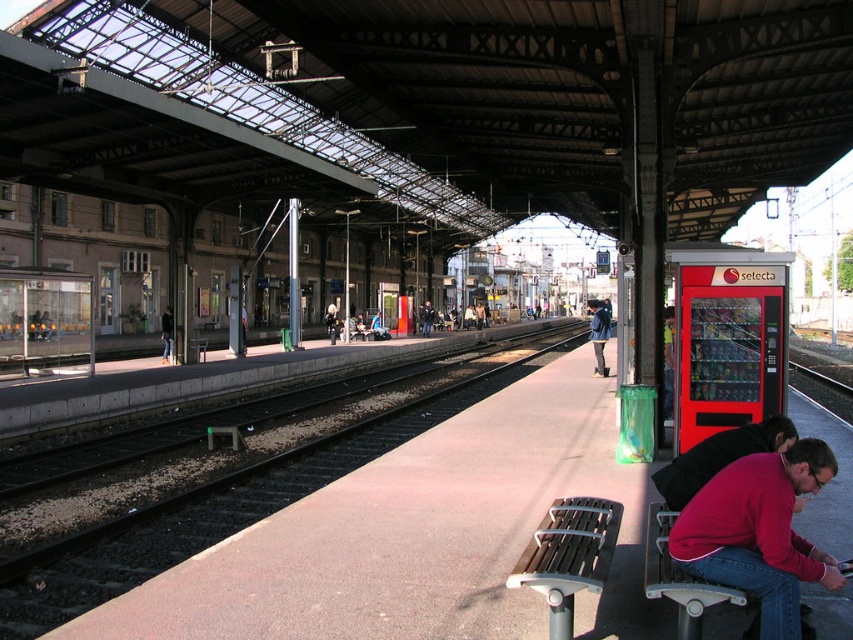
Does red sweater at lower right have a greater height compared to metallic gray bench at lower center?

Indeed, red sweater at lower right has a greater height compared to metallic gray bench at lower center.

Is red sweater at lower right wider than metallic gray bench at lower center?

No.

This screenshot has height=640, width=853. Identify the location of red sweater at lower right. (758, 532).

Does metallic silver bench at lower right have a lesser height compared to dark blue jeans at left?

Yes, metallic silver bench at lower right is shorter than dark blue jeans at left.

The height and width of the screenshot is (640, 853). What do you see at coordinates (677, 577) in the screenshot?
I see `metallic silver bench at lower right` at bounding box center [677, 577].

Where is `metallic silver bench at lower right`? This screenshot has height=640, width=853. metallic silver bench at lower right is located at coordinates (677, 577).

Does metallic gray bench at lower center appear over dark blue jeans at left?

No, metallic gray bench at lower center is not above dark blue jeans at left.

Describe the element at coordinates (567, 556) in the screenshot. I see `metallic gray bench at lower center` at that location.

You are a GUI agent. You are given a task and a screenshot of the screen. Output one action in this format:
    pyautogui.click(x=<x>, y=<y>)
    Task: Click on the metallic gray bench at lower center
    The width and height of the screenshot is (853, 640).
    Given the screenshot: What is the action you would take?
    pyautogui.click(x=567, y=556)